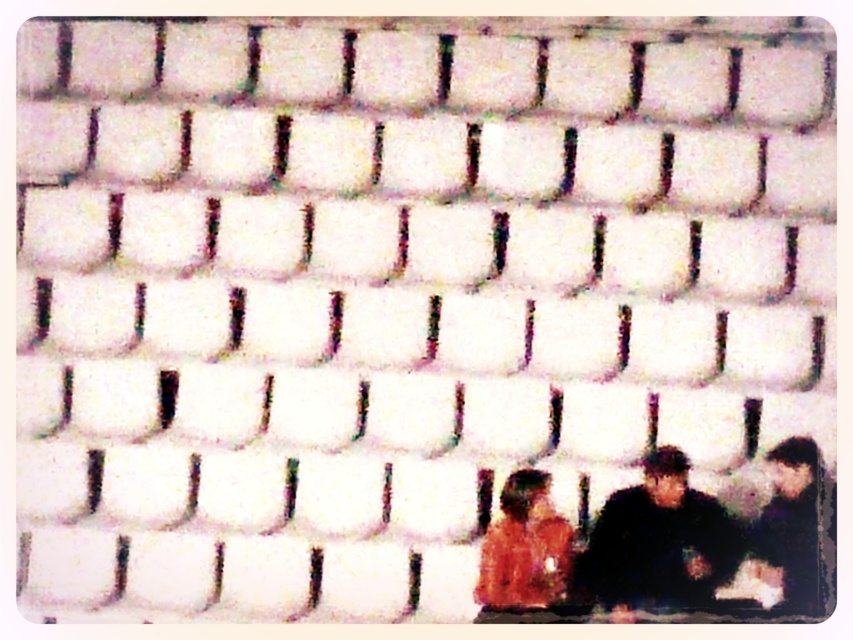
Question: Which of the following is the closest to the observer?

Choices:
 (A) (550, 522)
 (B) (738, 557)
 (C) (801, 518)
 (D) (802, 481)

Answer: (C)

Question: Does orange fabric couple at lower right appear on the left side of dark gray fabric jacket at lower right?

Choices:
 (A) no
 (B) yes

Answer: (B)

Question: Which object is positioned farthest from the orange fabric couple at lower right?

Choices:
 (A) dark gray fabric jacket at lower right
 (B) orange fabric shirt at lower right

Answer: (B)

Question: Is orange fabric shirt at lower right thinner than dark gray sweater at right?

Choices:
 (A) yes
 (B) no

Answer: (B)

Question: Does dark gray fabric jacket at lower right come behind orange fabric shirt at lower right?

Choices:
 (A) yes
 (B) no

Answer: (B)

Question: Estimate the real-world distances between objects in this image. Which object is closer to the dark gray fabric jacket at lower right?

Choices:
 (A) dark gray sweater at right
 (B) orange fabric couple at lower right
 (C) orange fabric shirt at lower right

Answer: (B)